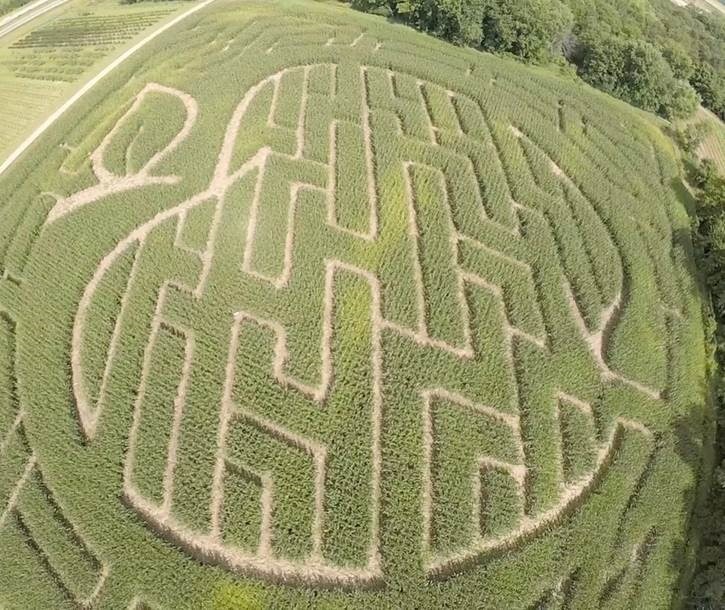
Locate an element on the screen. yellow shade is located at coordinates (407, 196).